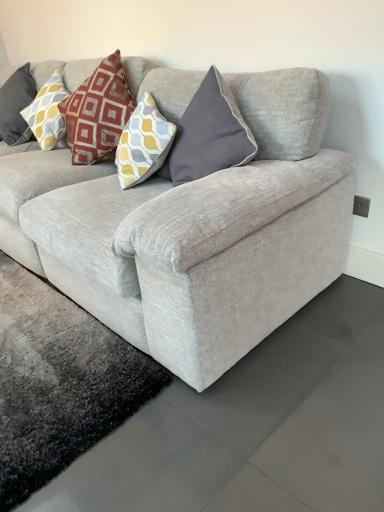
Question: Is matte yellow and gray diamond-patterned pillow at upper left at the left side of textured gray couch at center?

Choices:
 (A) yes
 (B) no

Answer: (A)

Question: From a real-world perspective, is matte yellow and gray diamond-patterned pillow at upper left under textured gray couch at center?

Choices:
 (A) no
 (B) yes

Answer: (A)

Question: Considering the relative sizes of matte yellow and gray diamond-patterned pillow at upper left and textured gray couch at center in the image provided, is matte yellow and gray diamond-patterned pillow at upper left shorter than textured gray couch at center?

Choices:
 (A) yes
 (B) no

Answer: (A)

Question: Can you confirm if matte yellow and gray diamond-patterned pillow at upper left is bigger than textured gray couch at center?

Choices:
 (A) no
 (B) yes

Answer: (A)

Question: Considering the relative positions of matte yellow and gray diamond-patterned pillow at upper left and textured gray couch at center in the image provided, is matte yellow and gray diamond-patterned pillow at upper left behind textured gray couch at center?

Choices:
 (A) no
 (B) yes

Answer: (B)

Question: From a real-world perspective, is matte yellow and gray diamond-patterned pillow at upper left positioned over textured gray couch at center based on gravity?

Choices:
 (A) no
 (B) yes

Answer: (B)

Question: Does textured gray couch at center appear on the right side of matte yellow and gray diamond-patterned pillow at upper left?

Choices:
 (A) yes
 (B) no

Answer: (A)

Question: Can you see textured gray couch at center touching matte yellow and gray diamond-patterned pillow at upper left?

Choices:
 (A) yes
 (B) no

Answer: (B)

Question: Is textured gray couch at center outside matte yellow and gray diamond-patterned pillow at upper left?

Choices:
 (A) yes
 (B) no

Answer: (A)

Question: From a real-world perspective, is textured gray couch at center beneath matte yellow and gray diamond-patterned pillow at upper left?

Choices:
 (A) no
 (B) yes

Answer: (B)

Question: From the image's perspective, does textured gray couch at center appear lower than matte yellow and gray diamond-patterned pillow at upper left?

Choices:
 (A) no
 (B) yes

Answer: (B)

Question: Is matte yellow and gray diamond-patterned pillow at upper left inside textured gray couch at center?

Choices:
 (A) yes
 (B) no

Answer: (A)

Question: Considering the positions of matte yellow and gray diamond-patterned pillow at upper left and textured gray couch at center in the image, is matte yellow and gray diamond-patterned pillow at upper left taller or shorter than textured gray couch at center?

Choices:
 (A) short
 (B) tall

Answer: (A)